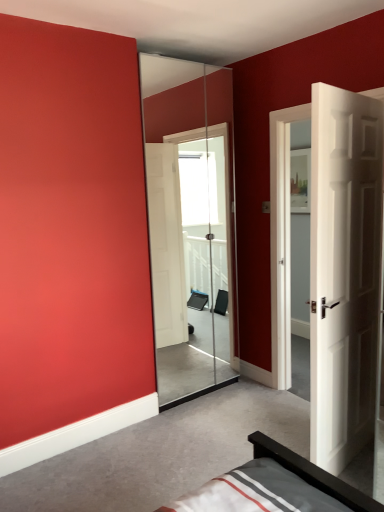
Where is `vacant space that is to the left of white wooden door at right`? The image size is (384, 512). vacant space that is to the left of white wooden door at right is located at coordinates (244, 443).